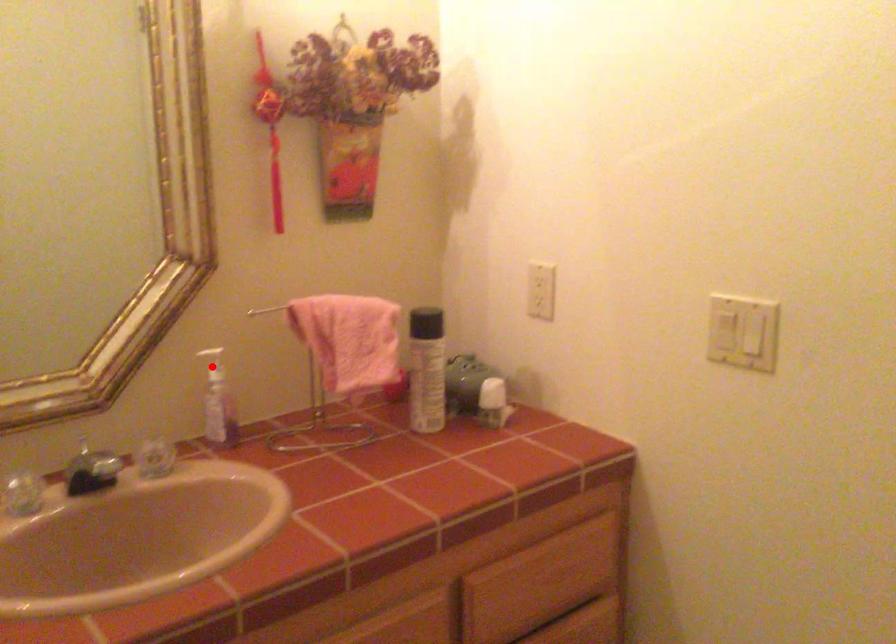
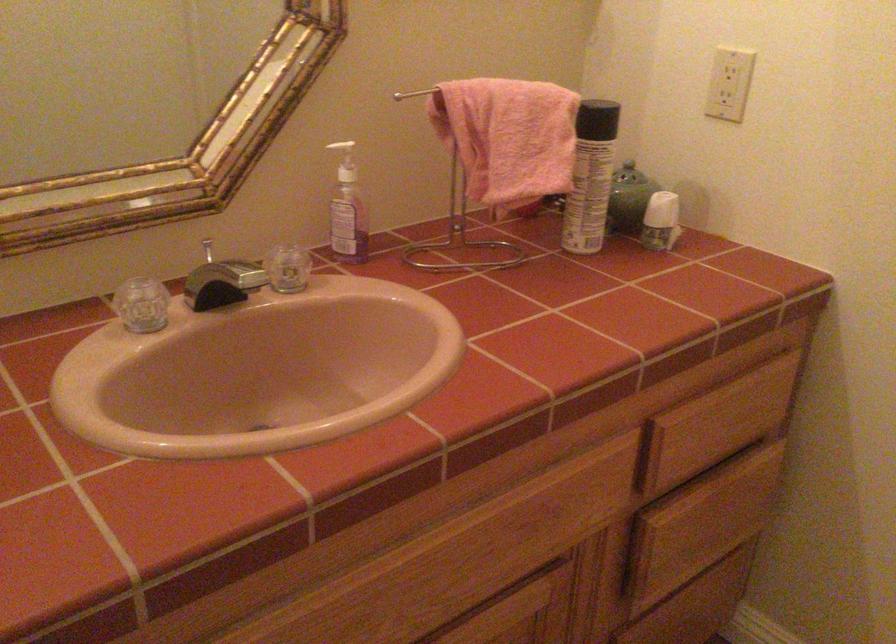
In the second image, find the point that corresponds to the highlighted location in the first image.

(345, 161)